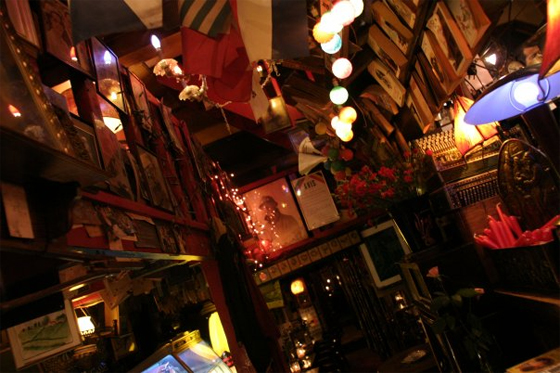
Locate an element on the screen. hanging lantern is located at coordinates (88, 328).